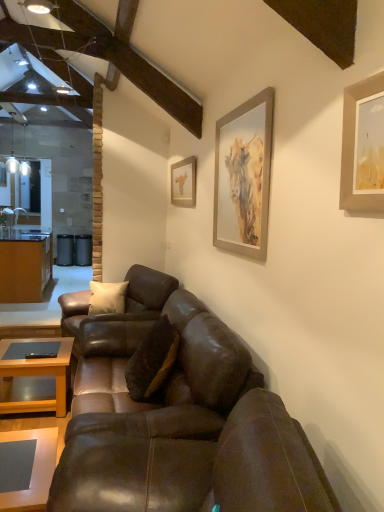
Question: Is brown leather couch at center, acting as the second studio couch starting from the front, taller or shorter than silver metallic picture frame at upper right, the 2th picture frame in the left-to-right sequence?

Choices:
 (A) tall
 (B) short

Answer: (A)

Question: In the image, is brown leather couch at center, acting as the 2th studio couch starting from the back, positioned in front of or behind silver metallic picture frame at upper right, the 1th picture frame when ordered from front to back?

Choices:
 (A) behind
 (B) front

Answer: (B)

Question: Which of these objects is positioned farthest from the matte gold picture frame at upper center, arranged as the first picture frame when viewed from the back?

Choices:
 (A) brown leather couch at lower center, placed as the first studio couch when sorted from front to back
 (B) matte gray coffee table at lower left, the 2th coffee table from the back
 (C) silver metallic picture frame at upper right, the 2th picture frame in the left-to-right sequence
 (D) matte wooden coffee table at lower left, the 2th coffee table positioned from the front
 (E) brown wood cabinetry at left

Answer: (E)

Question: Estimate the real-world distances between objects in this image. Which object is farther from the brown leather couch at center, acting as the 2th studio couch starting from the back?

Choices:
 (A) silver metallic picture frame at upper right, which ranks as the first picture frame in right-to-left order
 (B) brown leather couch at lower center, placed as the first studio couch when sorted from front to back
 (C) brown suede pillow at center
 (D) matte wooden coffee table at lower left, which is the second coffee table in right-to-left order
 (E) matte gray coffee table at lower left, the 1th coffee table in the right-to-left sequence

Answer: (A)